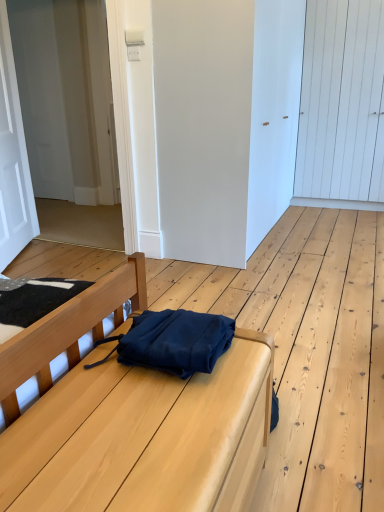
Question: Is navy blue fabric at center bigger than white matte door at upper left, which is counted as the second door, starting from the left?

Choices:
 (A) yes
 (B) no

Answer: (B)

Question: From the image's perspective, is navy blue fabric at center under white matte door at upper left, which is counted as the second door, starting from the left?

Choices:
 (A) yes
 (B) no

Answer: (A)

Question: Is navy blue fabric at center not close to white matte door at upper left, the 3th door viewed from the right?

Choices:
 (A) no
 (B) yes

Answer: (B)

Question: Is navy blue fabric at center aimed at white matte door at upper left, which is counted as the second door, starting from the left?

Choices:
 (A) yes
 (B) no

Answer: (B)

Question: Does navy blue fabric at center have a greater height compared to white matte door at upper left, which is counted as the second door, starting from the left?

Choices:
 (A) yes
 (B) no

Answer: (B)

Question: From the image's perspective, relative to white matte door at center, the second door viewed from the right, is navy blue fabric messenger bag at center above or below?

Choices:
 (A) above
 (B) below

Answer: (B)

Question: Considering the positions of navy blue fabric messenger bag at center and white matte door at center, which is the third door in left-to-right order, in the image, is navy blue fabric messenger bag at center wider or thinner than white matte door at center, which is the third door in left-to-right order,?

Choices:
 (A) wide
 (B) thin

Answer: (B)

Question: From a real-world perspective, is navy blue fabric messenger bag at center physically located above or below white matte door at center, the second door viewed from the right?

Choices:
 (A) below
 (B) above

Answer: (A)

Question: Is point (170, 309) positioned closer to the camera than point (218, 31)?

Choices:
 (A) closer
 (B) farther

Answer: (A)

Question: Is white wooden door at upper right, which is the 1th door in right-to-left order, taller or shorter than white matte door at left, the first door when ordered from left to right?

Choices:
 (A) tall
 (B) short

Answer: (A)

Question: Does point (329, 143) appear closer or farther from the camera than point (9, 155)?

Choices:
 (A) farther
 (B) closer

Answer: (A)

Question: Is white wooden door at upper right, which is the 1th door in right-to-left order, inside or outside of white matte door at left, positioned as the 4th door in right-to-left order?

Choices:
 (A) outside
 (B) inside

Answer: (A)

Question: From the image's perspective, is white wooden door at upper right, which is the 1th door in right-to-left order, above or below white matte door at left, the first door when ordered from left to right?

Choices:
 (A) above
 (B) below

Answer: (A)

Question: Considering the positions of point (165, 222) and point (26, 144), is point (165, 222) closer or farther from the camera than point (26, 144)?

Choices:
 (A) farther
 (B) closer

Answer: (B)

Question: In terms of size, does white matte door at center, the second door viewed from the right, appear bigger or smaller than white matte door at left, the first door when ordered from left to right?

Choices:
 (A) big
 (B) small

Answer: (A)